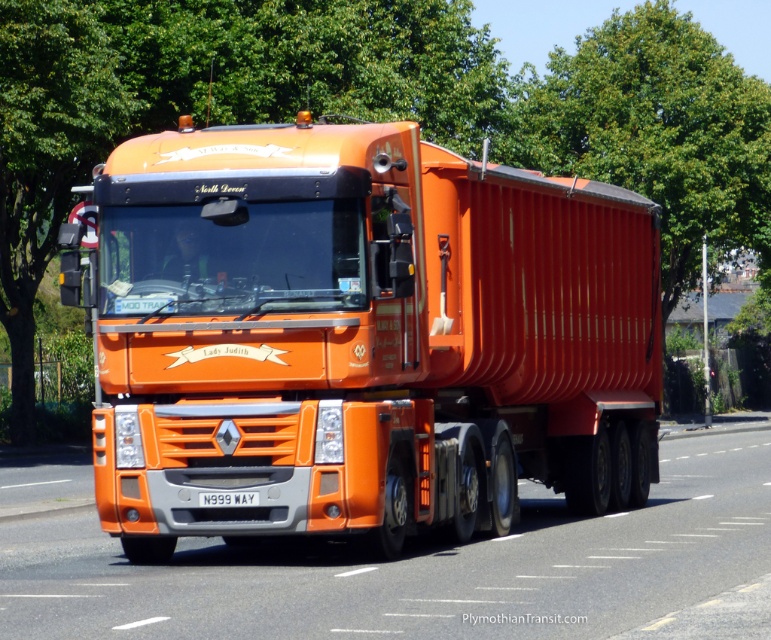
Question: Which point appears closest to the camera in this image?

Choices:
 (A) (207, 316)
 (B) (231, 500)
 (C) (517, 550)

Answer: (B)

Question: Is orange matte trailer truck at center to the left of white plastic license plate at center from the viewer's perspective?

Choices:
 (A) yes
 (B) no

Answer: (B)

Question: Which is nearer to the orange matte trailer truck at center?

Choices:
 (A) orange glossy truck at center
 (B) white plastic license plate at center

Answer: (A)

Question: Estimate the real-world distances between objects in this image. Which object is closer to the orange glossy truck at center?

Choices:
 (A) orange matte trailer truck at center
 (B) white plastic license plate at center

Answer: (A)

Question: Can you confirm if orange glossy truck at center is bigger than white plastic license plate at center?

Choices:
 (A) no
 (B) yes

Answer: (B)

Question: Can you confirm if orange glossy truck at center is smaller than white plastic license plate at center?

Choices:
 (A) yes
 (B) no

Answer: (B)